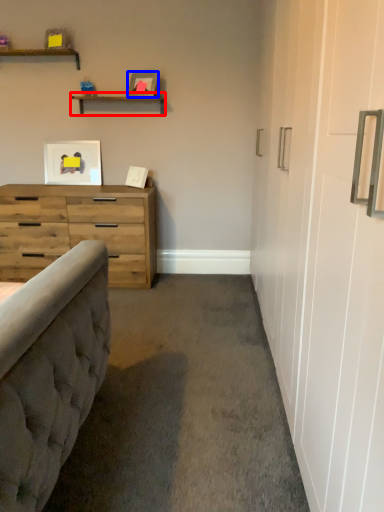
Question: Which point is further to the camera, shelf (highlighted by a red box) or picture frame (highlighted by a blue box)?

Choices:
 (A) shelf
 (B) picture frame

Answer: (A)